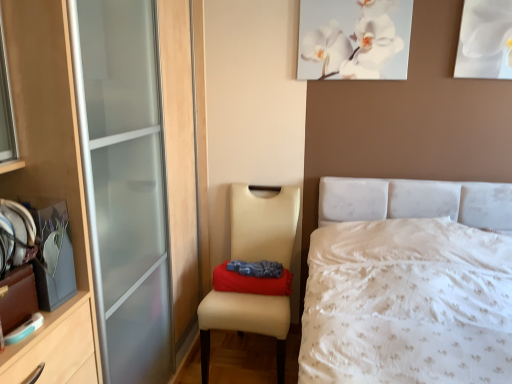
Question: Considering the relative sizes of white textured bed at center and red fabric pillow at center in the image provided, is white textured bed at center wider than red fabric pillow at center?

Choices:
 (A) yes
 (B) no

Answer: (A)

Question: From a real-world perspective, is white textured bed at center located beneath red fabric pillow at center?

Choices:
 (A) no
 (B) yes

Answer: (B)

Question: Is white textured bed at center not close to red fabric pillow at center?

Choices:
 (A) yes
 (B) no

Answer: (B)

Question: Are white textured bed at center and red fabric pillow at center making contact?

Choices:
 (A) yes
 (B) no

Answer: (B)

Question: Is white textured bed at center completely or partially outside of red fabric pillow at center?

Choices:
 (A) no
 (B) yes

Answer: (B)

Question: Would you say beige leather chair at lower left is to the left or to the right of white paper at upper right, which appears as the second picture frame when viewed from the left, in the picture?

Choices:
 (A) left
 (B) right

Answer: (A)

Question: From their relative heights in the image, would you say beige leather chair at lower left is taller or shorter than white paper at upper right, positioned as the first picture frame in right-to-left order?

Choices:
 (A) short
 (B) tall

Answer: (B)

Question: From a real-world perspective, is beige leather chair at lower left positioned above or below white paper at upper right, positioned as the first picture frame in right-to-left order?

Choices:
 (A) below
 (B) above

Answer: (A)

Question: From the image's perspective, relative to white paper at upper right, positioned as the first picture frame in right-to-left order, is beige leather chair at lower left above or below?

Choices:
 (A) below
 (B) above

Answer: (A)

Question: In terms of width, does white canvas at upper center, which is the 2th picture frame from right to left, look wider or thinner when compared to beige leather chair at lower left?

Choices:
 (A) wide
 (B) thin

Answer: (B)

Question: From their relative heights in the image, would you say white canvas at upper center, which is the 2th picture frame from right to left, is taller or shorter than beige leather chair at lower left?

Choices:
 (A) tall
 (B) short

Answer: (B)

Question: Would you say white canvas at upper center, acting as the first picture frame starting from the left, is to the left or to the right of beige leather chair at lower left in the picture?

Choices:
 (A) right
 (B) left

Answer: (A)

Question: From a real-world perspective, is white canvas at upper center, which is the 2th picture frame from right to left, above or below beige leather chair at lower left?

Choices:
 (A) above
 (B) below

Answer: (A)

Question: From a real-world perspective, is white canvas at upper center, which is the 2th picture frame from right to left, above or below white paper at upper right, which appears as the second picture frame when viewed from the left?

Choices:
 (A) below
 (B) above

Answer: (B)

Question: Based on their sizes in the image, would you say white canvas at upper center, which is the 2th picture frame from right to left, is bigger or smaller than white paper at upper right, which appears as the second picture frame when viewed from the left?

Choices:
 (A) big
 (B) small

Answer: (A)